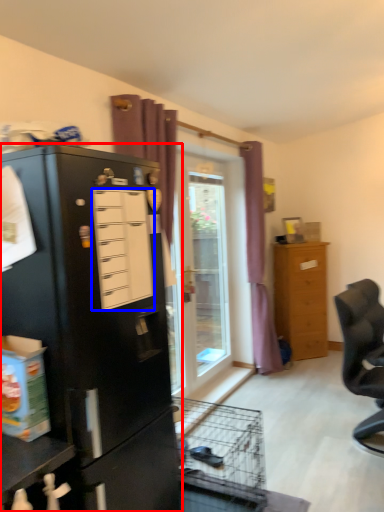
Question: Among these objects, which one is nearest to the camera, cupboard (highlighted by a red box) or drawer (highlighted by a blue box)?

Choices:
 (A) cupboard
 (B) drawer

Answer: (A)